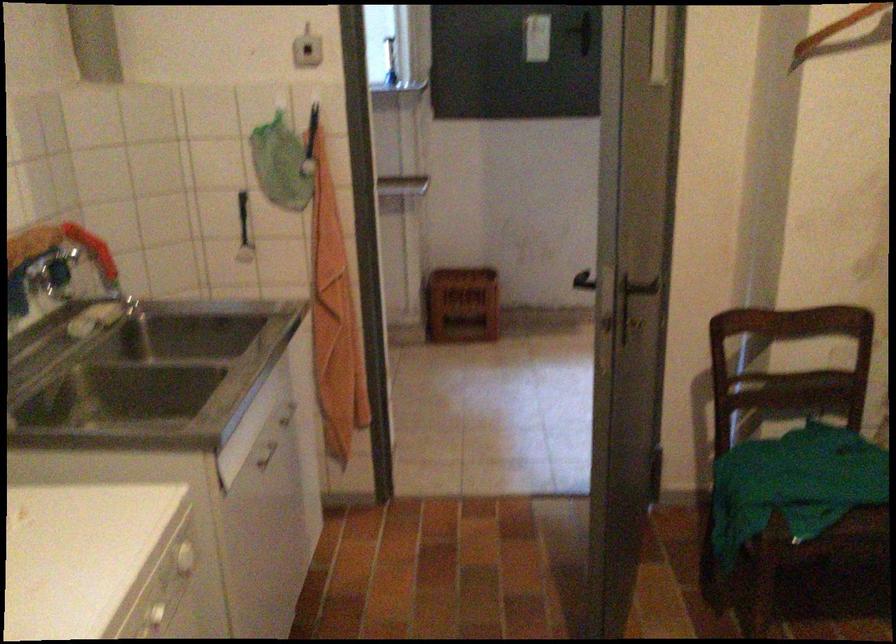
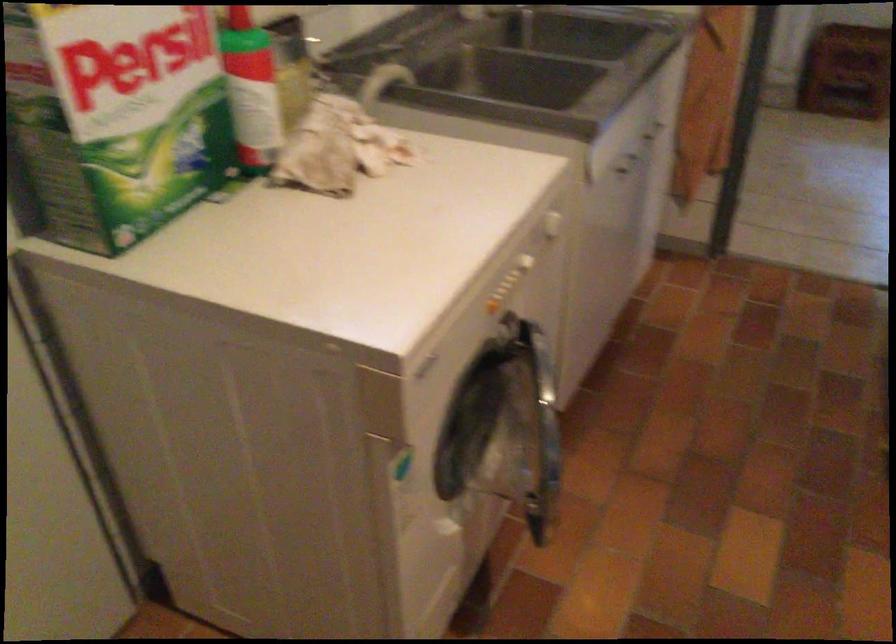
The images are taken continuously from a first-person perspective. In which direction are you moving?

The cameraman moved toward left, backward.